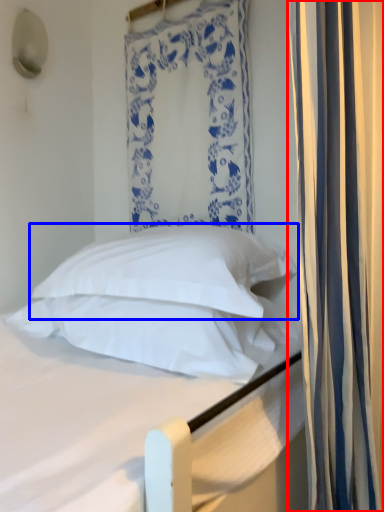
Question: Which object is closer to the camera taking this photo, curtain (highlighted by a red box) or pillow (highlighted by a blue box)?

Choices:
 (A) curtain
 (B) pillow

Answer: (A)